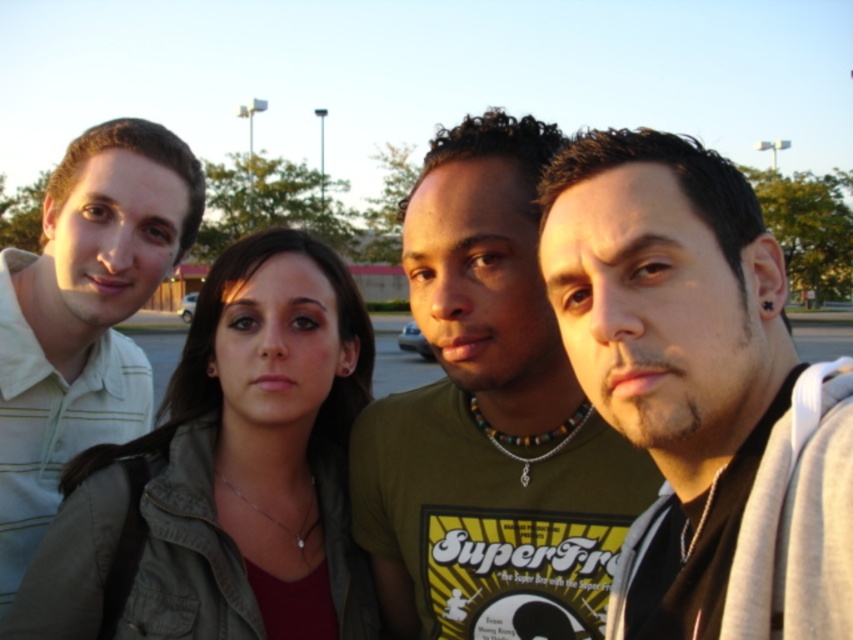
You are a photographer trying to capture a group photo of the matte olive green jacket at center and the light green striped shirt at left. Since you want to ensure both subjects are in focus, which one should you focus on first to account for their positions?

You should focus on the matte olive green jacket at center first because it is in front of the light green striped shirt at left, so focusing on the closer subject will help both be in focus.

You are trying to decide which of the two shirts in the image is more likely to be a men or women clothing item based on their size. The two shirts are the matte black shirt at center and the light green striped shirt at left. Which one is bigger?

The matte black shirt at center is bigger than the light green striped shirt at left, so it is more likely to be a men clothing item.